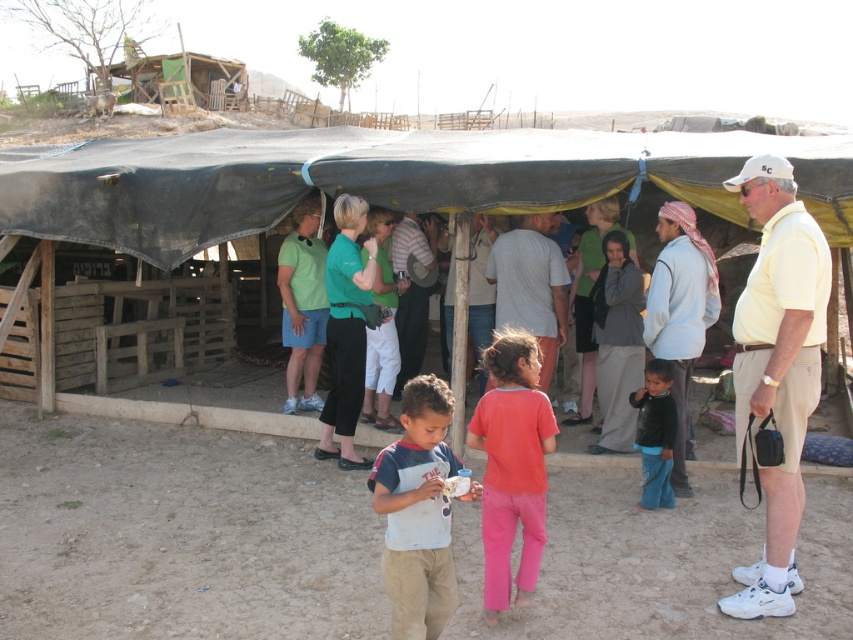
You are a photographer positioned outside the shelter. You want to take a photo that includes both the yellow cotton shirt at right and the gray cotton shirt at center. Which shirt will appear larger in the photo?

The yellow cotton shirt at right will appear larger in the photo because it is closer to the viewer than the gray cotton shirt at center.

You are standing at the entrance of the shelter and need to locate the gray cotton shirt at center. According to the coordinates provided, in which direction should you look to find it?

The gray cotton shirt at center is located at coordinates point (x=531, y=285). Since the x and y coordinates are both between 0 and 1, this places it near the center of the image. Therefore, you should look straight ahead towards the center of the shelter to find the gray cotton shirt at center.

You are standing under the shelter and notice two items at the center. The gray cotton shirt at center and the dark gray fabric at center. Which one is positioned higher?

The gray cotton shirt at center is located above the dark gray fabric at center, so the gray cotton shirt at center is positioned higher.